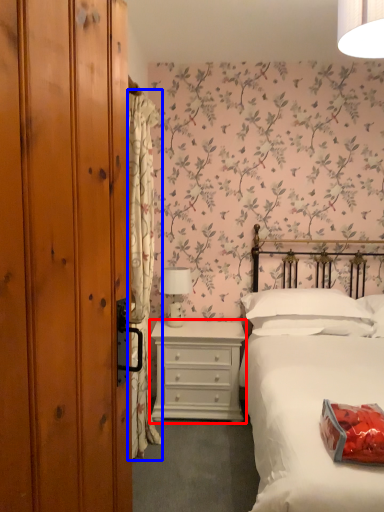
Question: Which point is further to the camera, chest of drawers (highlighted by a red box) or curtain (highlighted by a blue box)?

Choices:
 (A) chest of drawers
 (B) curtain

Answer: (A)